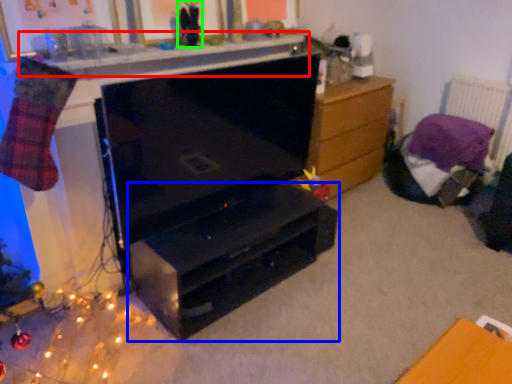
Question: Considering the real-world distances, which object is farthest from counter top (highlighted by a red box)? desk (highlighted by a blue box) or toy (highlighted by a green box)?

Choices:
 (A) desk
 (B) toy

Answer: (A)